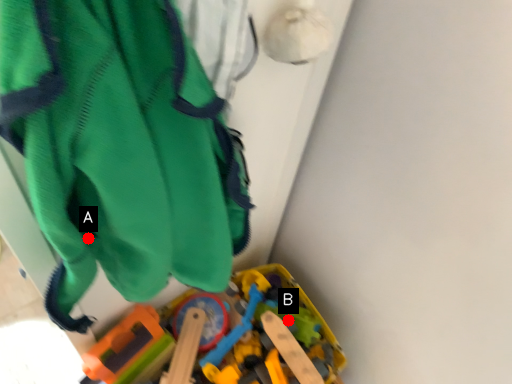
Question: Two points are circled on the image, labeled by A and B beside each circle. Which of the following is the farthest from the observer?

Choices:
 (A) A is further
 (B) B is further

Answer: (B)